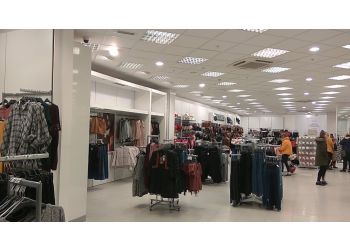
The width and height of the screenshot is (350, 250). Identify the location of ceiling vent. (251, 65).